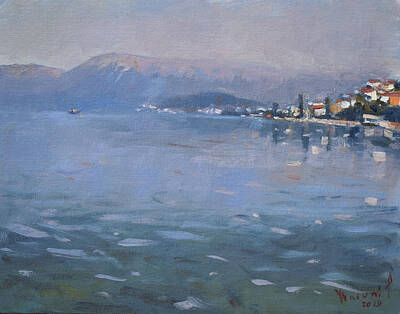
Identify the location of white walls. This screenshot has height=314, width=400. (372, 95).